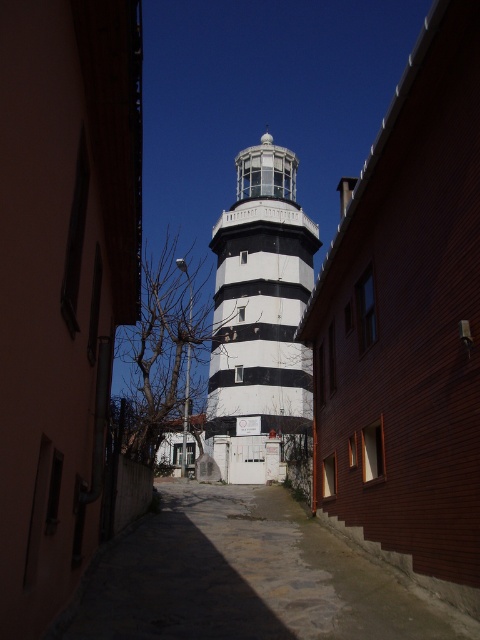
Is smooth stone alley at center thinner than white painted concrete water tower at center?

Yes, smooth stone alley at center is thinner than white painted concrete water tower at center.

Does smooth stone alley at center appear under white painted concrete water tower at center?

Yes, smooth stone alley at center is below white painted concrete water tower at center.

Does point (304, 577) come farther from viewer compared to point (240, 316)?

No, it is not.

Locate an element on the screen. smooth stone alley at center is located at coordinates (249, 577).